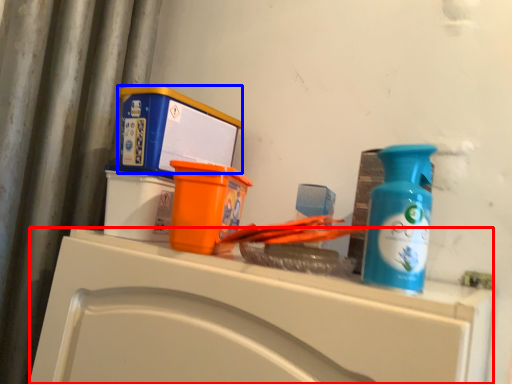
Question: Which point is closer to the camera, counter (highlighted by a red box) or box (highlighted by a blue box)?

Choices:
 (A) counter
 (B) box

Answer: (A)